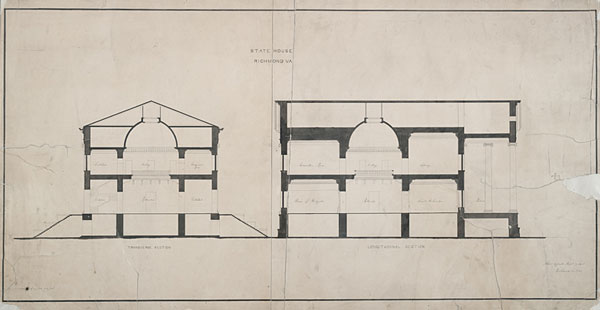
You are a GUI agent. You are given a task and a screenshot of the screen. Output one action in this format:
    pyautogui.click(x=<x>, y=<y>)
    Task: Click on the room
    The image size is (600, 310).
    Given the screenshot: What is the action you would take?
    pyautogui.click(x=426, y=201), pyautogui.click(x=378, y=200), pyautogui.click(x=321, y=199)